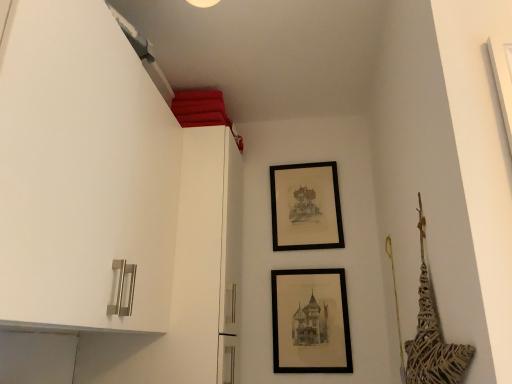
Question: Which direction should I rotate to look at black matte picture frame at upper center, which is the second picture frame from front to back?

Choices:
 (A) left
 (B) right

Answer: (B)

Question: Is matte black picture frame at center, the 1th picture frame from the front, taller than black matte picture frame at upper center, which appears as the first picture frame when viewed from the back?

Choices:
 (A) no
 (B) yes

Answer: (A)

Question: From a real-world perspective, is matte black picture frame at center, the 1th picture frame from the front, positioned over black matte picture frame at upper center, which is the second picture frame from front to back, based on gravity?

Choices:
 (A) yes
 (B) no

Answer: (B)

Question: Would you say black matte picture frame at upper center, the 2th picture frame ordered from the bottom, is part of matte black picture frame at center, the 2th picture frame from the top,'s contents?

Choices:
 (A) yes
 (B) no

Answer: (B)

Question: Is matte black picture frame at center, which appears as the second picture frame when viewed from the back, outside black matte picture frame at upper center, which appears as the first picture frame when viewed from the back?

Choices:
 (A) yes
 (B) no

Answer: (A)

Question: Could you tell me if matte black picture frame at center, acting as the first picture frame starting from the bottom, is facing black matte picture frame at upper center, marked as the first picture frame in a top-to-bottom arrangement?

Choices:
 (A) yes
 (B) no

Answer: (B)

Question: Considering the relative positions of matte black picture frame at center, which appears as the second picture frame when viewed from the back, and black matte picture frame at upper center, marked as the first picture frame in a top-to-bottom arrangement, in the image provided, is matte black picture frame at center, which appears as the second picture frame when viewed from the back, behind black matte picture frame at upper center, marked as the first picture frame in a top-to-bottom arrangement,?

Choices:
 (A) yes
 (B) no

Answer: (B)

Question: Does black matte picture frame at upper center, marked as the first picture frame in a top-to-bottom arrangement, have a greater height compared to matte black picture frame at center, the 2th picture frame from the top?

Choices:
 (A) no
 (B) yes

Answer: (B)

Question: From a real-world perspective, is black matte picture frame at upper center, marked as the first picture frame in a top-to-bottom arrangement, physically above matte black picture frame at center, which appears as the second picture frame when viewed from the back?

Choices:
 (A) yes
 (B) no

Answer: (A)

Question: Is there a large distance between black matte picture frame at upper center, marked as the first picture frame in a top-to-bottom arrangement, and matte black picture frame at center, the 1th picture frame from the front?

Choices:
 (A) no
 (B) yes

Answer: (A)

Question: Is black matte picture frame at upper center, the 2th picture frame ordered from the bottom, positioned behind matte black picture frame at center, which appears as the second picture frame when viewed from the back?

Choices:
 (A) yes
 (B) no

Answer: (A)

Question: Is black matte picture frame at upper center, the 2th picture frame ordered from the bottom, positioned beyond the bounds of matte black picture frame at center, the 2th picture frame from the top?

Choices:
 (A) yes
 (B) no

Answer: (A)

Question: Is black matte picture frame at upper center, which is the second picture frame from front to back, placed right next to matte black picture frame at center, the 2th picture frame from the top?

Choices:
 (A) yes
 (B) no

Answer: (B)

Question: From a real-world perspective, is matte black picture frame at center, the 1th picture frame from the front, positioned above or below black matte picture frame at upper center, which appears as the first picture frame when viewed from the back?

Choices:
 (A) above
 (B) below

Answer: (B)